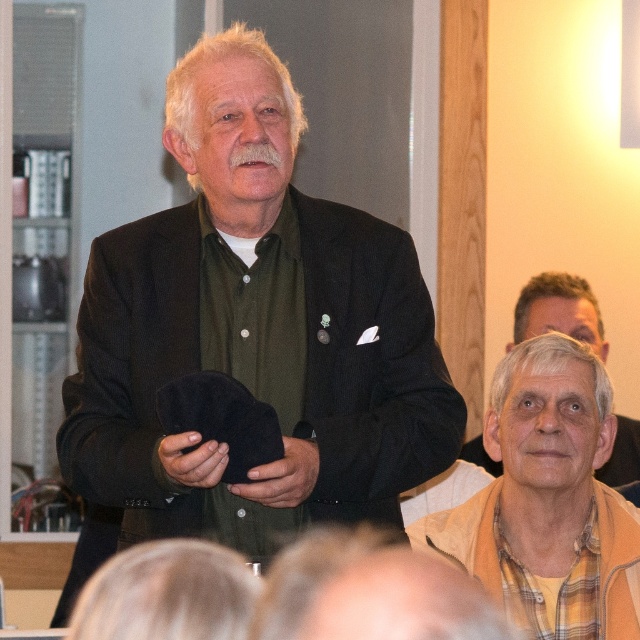
Which is above, dark green fabric shirt at center or yellow plaid shirt at center?

dark green fabric shirt at center

Is dark green fabric shirt at center to the right of yellow plaid shirt at center from the viewer's perspective?

In fact, dark green fabric shirt at center is to the left of yellow plaid shirt at center.

Who is more forward, (291, 499) or (566, 369)?

Point (291, 499)

Identify the location of dark green fabric shirt at center. This screenshot has height=640, width=640. (253, 332).

Is point (67, 586) positioned in front of point (634, 452)?

That is True.

Does dark green fabric shirt at center appear under gray woolen sweater at lower right?

Yes.

Locate an element on the screen. The width and height of the screenshot is (640, 640). dark green fabric shirt at center is located at coordinates (253, 332).

Is point (612, 541) closer to viewer compared to point (593, 314)?

Yes, it is in front of point (593, 314).

Is yellow plaid shirt at center wider than gray woolen sweater at lower right?

Indeed, yellow plaid shirt at center has a greater width compared to gray woolen sweater at lower right.

Is point (556, 557) farther from viewer compared to point (528, 308)?

No, (556, 557) is in front of (528, 308).

Locate an element on the screen. The image size is (640, 640). yellow plaid shirt at center is located at coordinates (548, 497).